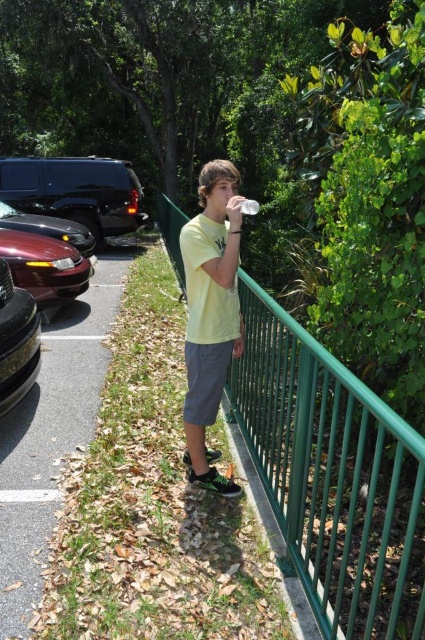
Which is more to the right, yellow matte shirt at center or shiny maroon sedan at left?

From the viewer's perspective, yellow matte shirt at center appears more on the right side.

Who is positioned more to the left, yellow matte shirt at center or shiny maroon sedan at left?

shiny maroon sedan at left

This screenshot has width=425, height=640. Identify the location of yellow matte shirt at center. (210, 312).

Locate an element on the screen. yellow matte shirt at center is located at coordinates (210, 312).

Does shiny black suv at left have a smaller size compared to shiny maroon sedan at left?

Actually, shiny black suv at left might be larger than shiny maroon sedan at left.

Is shiny black suv at left bigger than shiny maroon sedan at left?

Indeed, shiny black suv at left has a larger size compared to shiny maroon sedan at left.

Does point (113, 196) come in front of point (45, 243)?

No.

Locate an element on the screen. The width and height of the screenshot is (425, 640). shiny black suv at left is located at coordinates (76, 192).

Can you confirm if green metal fence at right is bigger than shiny black car at left?

Yes, green metal fence at right is bigger than shiny black car at left.

Does green metal fence at right appear on the left side of shiny black car at left?

Incorrect, green metal fence at right is not on the left side of shiny black car at left.

Who is more distant from viewer, [299,436] or [16,364]?

The point [16,364] is behind.

Identify the location of green metal fence at right. (333, 476).